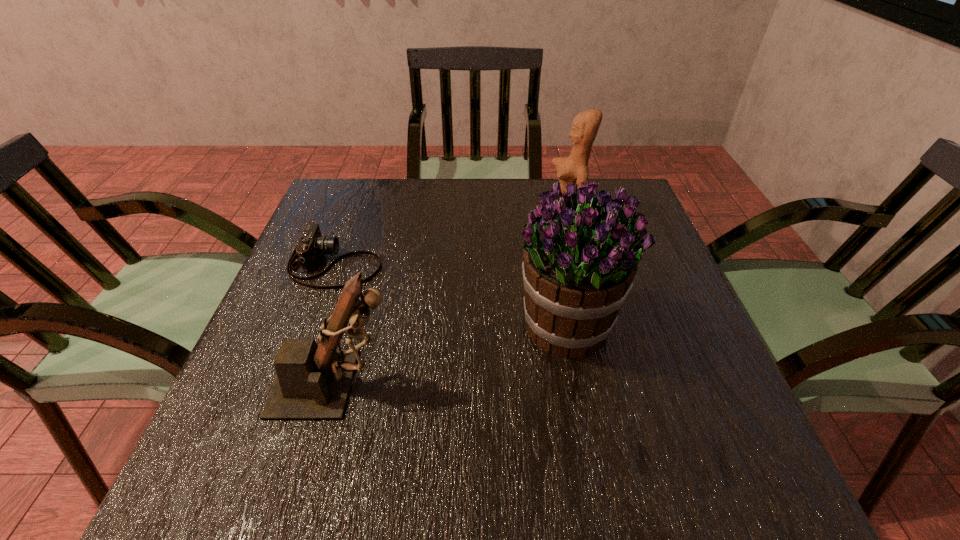
At what (x,y) coordinates should I click in order to perform the action: click on bouquet. Please return your answer as a coordinate pair (x, y). Image resolution: width=960 pixels, height=540 pixels. Looking at the image, I should click on (580, 258).

You are a GUI agent. You are given a task and a screenshot of the screen. Output one action in this format:
    pyautogui.click(x=<x>, y=<y>)
    Task: Click on the right figurine
    
    Given the screenshot: What is the action you would take?
    pyautogui.click(x=574, y=169)

I want to click on the farther figurine, so click(x=574, y=169).

Locate an element on the screen. the nearer figurine is located at coordinates (313, 382).

I want to click on the shortest object, so click(x=311, y=245).

The width and height of the screenshot is (960, 540). I want to click on free space located 0.080m on the back of the bouquet, so click(x=554, y=265).

The image size is (960, 540). Find the location of `vacant space located on the front-facing side of the farther figurine`. vacant space located on the front-facing side of the farther figurine is located at coordinates (417, 218).

Where is `free space located 0.290m on the front-facing side of the farther figurine`? free space located 0.290m on the front-facing side of the farther figurine is located at coordinates (439, 218).

You are a GUI agent. You are given a task and a screenshot of the screen. Output one action in this format:
    pyautogui.click(x=<x>, y=<y>)
    Task: Click on the blank space located on the front-facing side of the farther figurine
    The width and height of the screenshot is (960, 540).
    Given the screenshot: What is the action you would take?
    pyautogui.click(x=432, y=218)

Locate an element on the screen. The width and height of the screenshot is (960, 540). vacant space situated 0.140m on the front-facing side of the nearer figurine is located at coordinates click(477, 384).